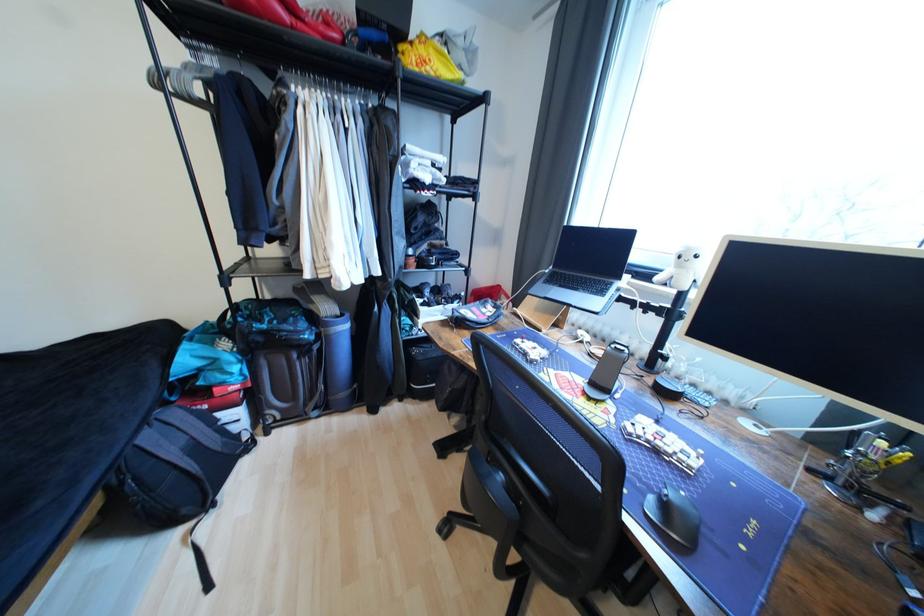
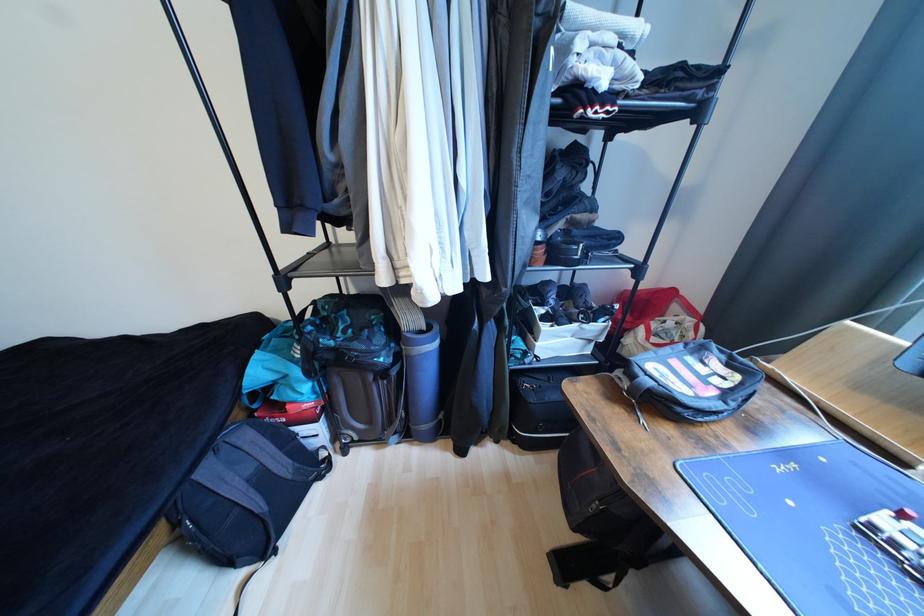
What movement of the cameraman would produce the second image?

The cameraman moved toward left, forward.